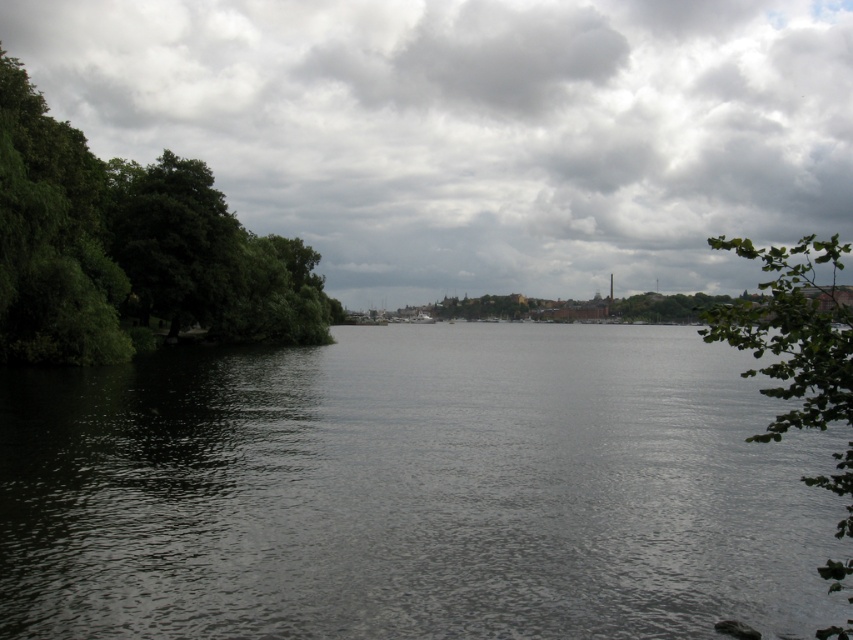
You are standing on the riverside path and see both the dark water at center and the green leafy branch at right. Which object is closer to your left side?

The dark water at center is closer to your left side because it is positioned on the left side of the green leafy branch at right.

You are a small boat that is 2 meters long. You are currently floating on the dark water at center and want to reach the green leafy trees at left. Can you safely navigate towards them without running aground?

The distance between the dark water at center and green leafy trees at left is 16.86 meters. Since your boat is only 2 meters long, you have sufficient space to navigate safely towards the green leafy trees at left without any risk of running aground.

You are planning to take a photo of the dark water at center and the cloudy sky at upper center. Which one of these two elements will occupy a smaller portion of the photo frame?

The dark water at center occupies a smaller portion of the photo frame because its width is less than that of the cloudy sky at upper center.